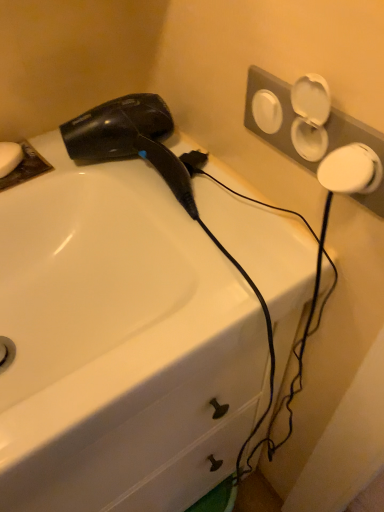
You are a GUI agent. You are given a task and a screenshot of the screen. Output one action in this format:
    pyautogui.click(x=<x>, y=<y>)
    Task: Click on the free space on the front side of black glossy hair dryer at upper left
    Image resolution: width=384 pixels, height=512 pixels.
    Given the screenshot: What is the action you would take?
    pyautogui.click(x=205, y=282)